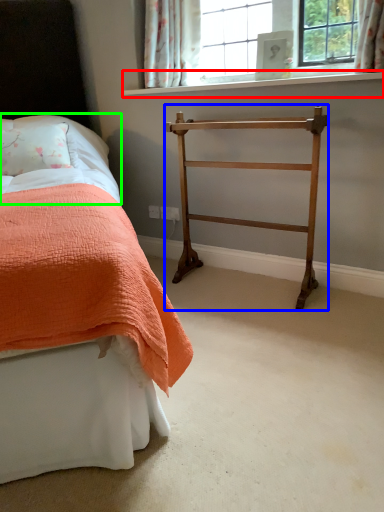
Question: Which object is positioned closest to window sill (highlighted by a red box)? Select from furniture (highlighted by a blue box) and sheet (highlighted by a green box).

Choices:
 (A) furniture
 (B) sheet

Answer: (A)